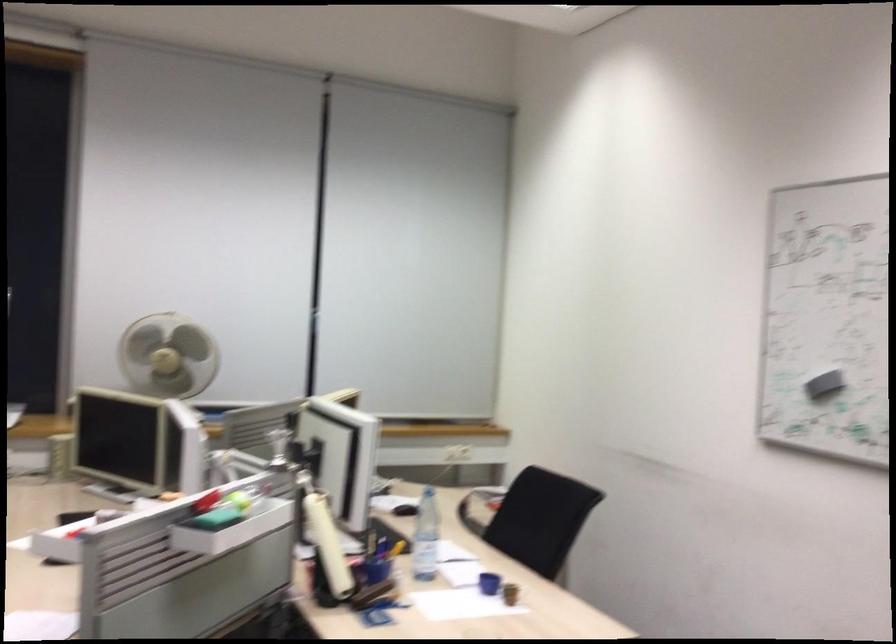
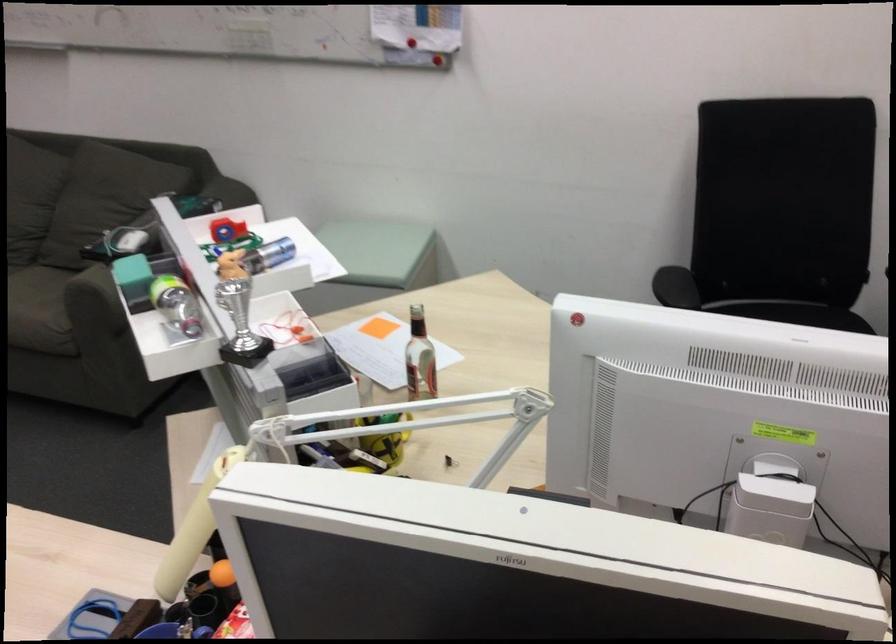
Where in the second image is the point corresponding to point 164,547 from the first image?

(240, 324)